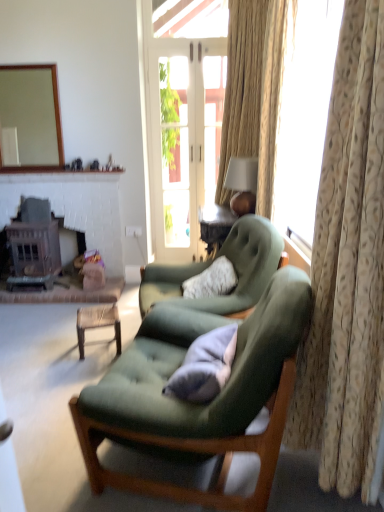
Question: Is velvet green armchair at center, arranged as the 2th chair when viewed from the front, thinner than soft gray cushion at center?

Choices:
 (A) yes
 (B) no

Answer: (B)

Question: Does velvet green armchair at center, marked as the first chair in a back-to-front arrangement, have a lesser height compared to soft gray cushion at center?

Choices:
 (A) yes
 (B) no

Answer: (B)

Question: Does velvet green armchair at center, arranged as the 2th chair when viewed from the front, appear on the right side of soft gray cushion at center?

Choices:
 (A) yes
 (B) no

Answer: (A)

Question: From a real-world perspective, does velvet green armchair at center, marked as the first chair in a back-to-front arrangement, stand above soft gray cushion at center?

Choices:
 (A) no
 (B) yes

Answer: (A)

Question: Is velvet green armchair at center, arranged as the 2th chair when viewed from the front, at the left side of soft gray cushion at center?

Choices:
 (A) no
 (B) yes

Answer: (A)

Question: Is white plastic power outlet at center taller or shorter than velvet green armchair at center, arranged as the 2th chair when viewed from the front?

Choices:
 (A) short
 (B) tall

Answer: (A)

Question: Considering the positions of point (127, 231) and point (190, 269), is point (127, 231) closer or farther from the camera than point (190, 269)?

Choices:
 (A) closer
 (B) farther

Answer: (B)

Question: From the image's perspective, is white plastic power outlet at center positioned above or below velvet green armchair at center, arranged as the 2th chair when viewed from the front?

Choices:
 (A) below
 (B) above

Answer: (B)

Question: From a real-world perspective, is white plastic power outlet at center above or below velvet green armchair at center, marked as the first chair in a back-to-front arrangement?

Choices:
 (A) above
 (B) below

Answer: (A)

Question: Is point (200, 120) positioned closer to the camera than point (332, 222)?

Choices:
 (A) farther
 (B) closer

Answer: (A)

Question: From their relative heights in the image, would you say clear glass door at center is taller or shorter than beige floral fabric curtain at right, which is counted as the second curtain, starting from the back?

Choices:
 (A) tall
 (B) short

Answer: (A)

Question: Is clear glass door at center in front of or behind beige floral fabric curtain at right, positioned as the 1th curtain in front-to-back order, in the image?

Choices:
 (A) front
 (B) behind

Answer: (B)

Question: Is clear glass door at center inside the boundaries of beige floral fabric curtain at right, which is counted as the second curtain, starting from the back, or outside?

Choices:
 (A) outside
 (B) inside

Answer: (A)

Question: In terms of height, does velvet green armchair at center, marked as the first chair in a back-to-front arrangement, look taller or shorter compared to matte brown lampshade at upper right?

Choices:
 (A) tall
 (B) short

Answer: (A)

Question: Considering the positions of velvet green armchair at center, marked as the first chair in a back-to-front arrangement, and matte brown lampshade at upper right in the image, is velvet green armchair at center, marked as the first chair in a back-to-front arrangement, wider or thinner than matte brown lampshade at upper right?

Choices:
 (A) thin
 (B) wide

Answer: (B)